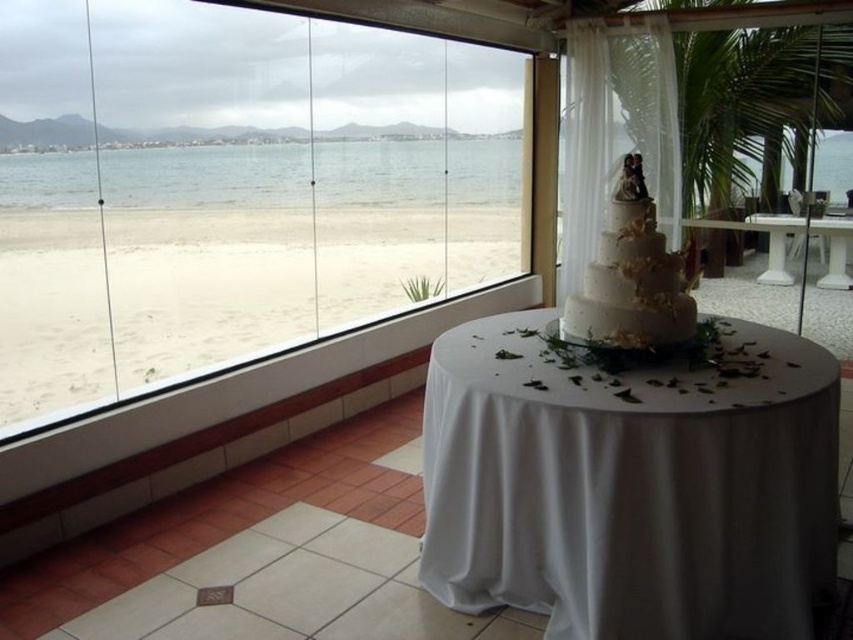
Question: Among these points, which one is farthest from the camera?

Choices:
 (A) (286, 148)
 (B) (827, 266)
 (C) (357, 172)

Answer: (B)

Question: Which point is farther from the camera taking this photo?

Choices:
 (A) (614, 252)
 (B) (430, 163)
 (C) (56, 193)

Answer: (B)

Question: Can you confirm if white cloth-covered table at center is positioned above white glossy table at center?

Choices:
 (A) no
 (B) yes

Answer: (A)

Question: Does white cloth-covered table at center appear over white textured cake at center?

Choices:
 (A) no
 (B) yes

Answer: (A)

Question: Is transparent glass window at center thinner than white cloth-covered table at center?

Choices:
 (A) no
 (B) yes

Answer: (A)

Question: Based on their relative distances, which object is nearer to the white cloth-covered table at center?

Choices:
 (A) transparent glass window at center
 (B) clear water at center
 (C) white textured cake at center

Answer: (C)